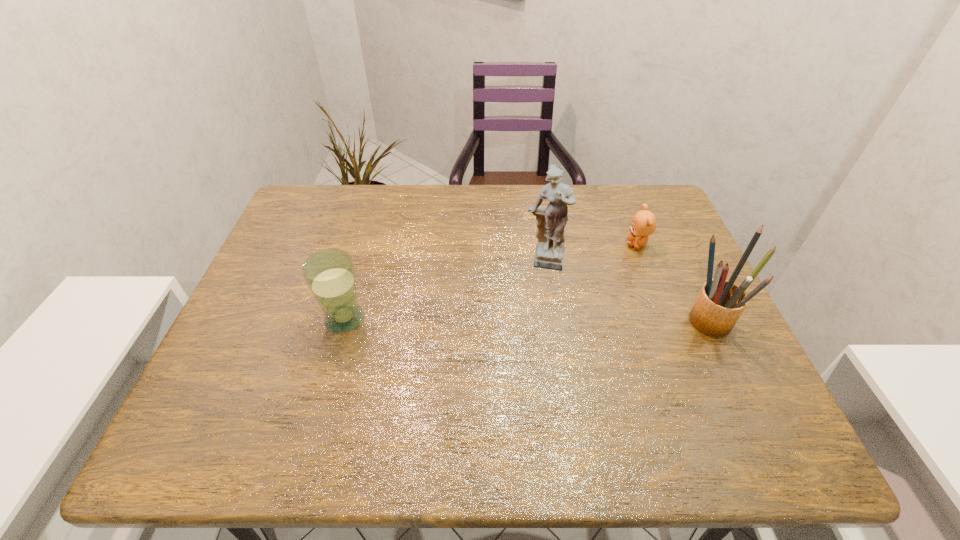
Identify the location of vacant space at the far right corner of the desktop. The image size is (960, 540). (668, 228).

This screenshot has width=960, height=540. What are the coordinates of `vacant point located between the second tallest object and the teddy bear` in the screenshot? It's located at (672, 282).

This screenshot has height=540, width=960. I want to click on vacant area that lies between the pencil box and the third object from right to left, so click(626, 291).

Find the location of a particular element. This screenshot has width=960, height=540. vacant space that is in between the glass and the pencil box is located at coordinates (525, 320).

Identify the location of unoccupied position between the glass and the shortest object. The image size is (960, 540). (491, 282).

Find the location of a particular element. The image size is (960, 540). vacant area that lies between the second tallest object and the shortest object is located at coordinates (672, 282).

Where is `free space between the second tallest object and the glass`? This screenshot has width=960, height=540. free space between the second tallest object and the glass is located at coordinates (525, 320).

At what (x,y) coordinates should I click in order to perform the action: click on empty space between the second shortest object and the pencil box. Please return your answer as a coordinate pair (x, y). This screenshot has height=540, width=960. Looking at the image, I should click on (525, 320).

You are a GUI agent. You are given a task and a screenshot of the screen. Output one action in this format:
    pyautogui.click(x=<x>, y=<y>)
    Task: Click on the vacant space that is in between the glass and the pencil box
    The image size is (960, 540).
    Given the screenshot: What is the action you would take?
    pyautogui.click(x=525, y=320)

At what (x,y) coordinates should I click in order to perform the action: click on unoccupied area between the shortest object and the second tallest object. Please return your answer as a coordinate pair (x, y). The image size is (960, 540). Looking at the image, I should click on (672, 282).